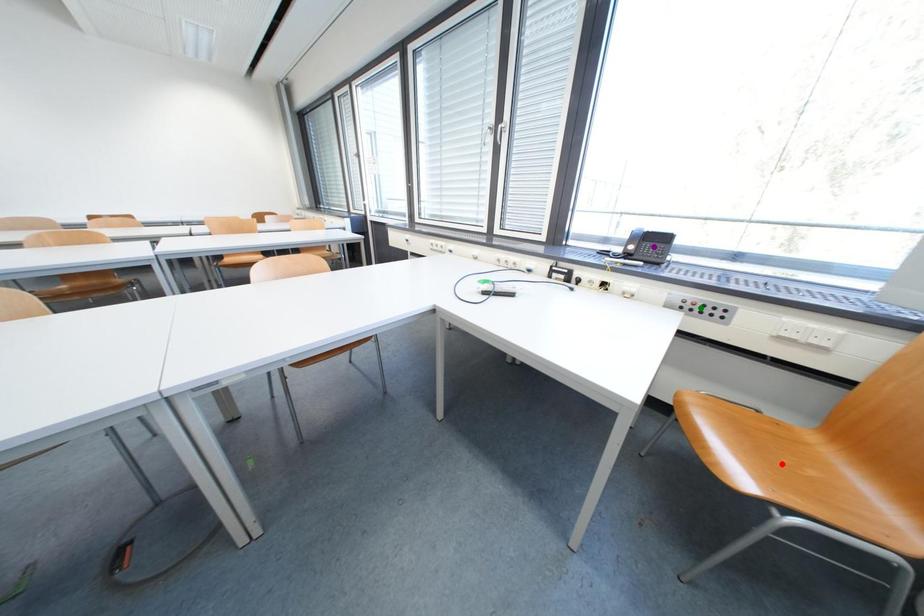
Order these from nearest to farthest:
red point, purple point, green point

1. purple point
2. green point
3. red point